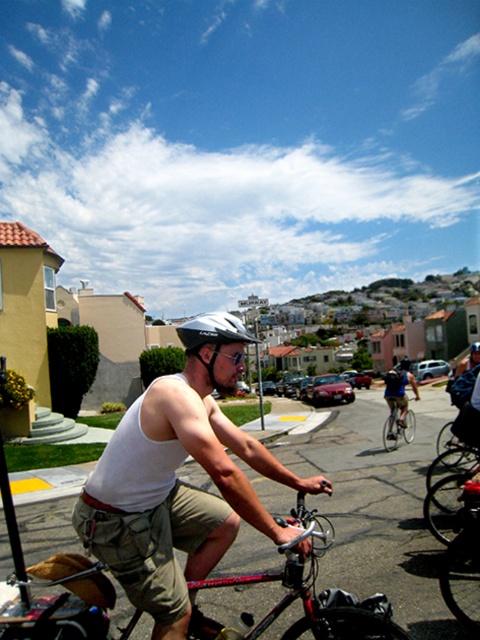
Does point (317, 529) come farther from viewer compared to point (386, 371)?

No, (317, 529) is in front of (386, 371).

Is point (379, 637) positioned after point (399, 417)?

No, (379, 637) is in front of (399, 417).

The width and height of the screenshot is (480, 640). What are the coordinates of `shiny metallic bicycle at center` in the screenshot? It's located at (310, 593).

Who is more distant from viewer, (207, 339) or (216, 385)?

The point (216, 385) is behind.

At what (x,y) coordinates should I click in order to perform the action: click on white matte tank top at center. Please return your answer as a coordinate pair (x, y). This screenshot has height=640, width=480. Looking at the image, I should click on (180, 483).

Locate an element on the screen. Image resolution: width=480 pixels, height=640 pixels. white matte tank top at center is located at coordinates (180, 483).

What do you see at coordinates (310, 593) in the screenshot?
I see `shiny metallic bicycle at center` at bounding box center [310, 593].

Based on the photo, can you confirm if shiny metallic bicycle at center is shorter than metallic silver bicycle at center?

Incorrect, shiny metallic bicycle at center's height does not fall short of metallic silver bicycle at center's.

Between point (304, 632) and point (394, 419), which one is positioned in front?

Point (304, 632) is in front.

The width and height of the screenshot is (480, 640). Find the location of `shiny metallic bicycle at center`. shiny metallic bicycle at center is located at coordinates (310, 593).